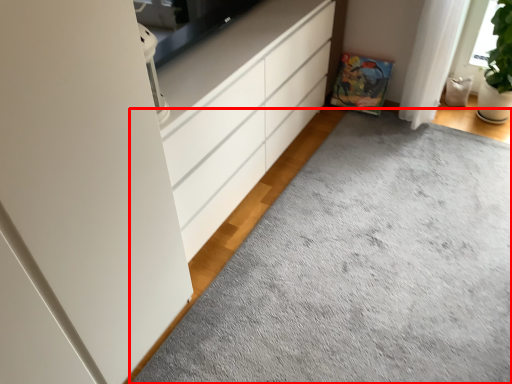
Question: From the image's perspective, what is the correct spatial relationship of plain (annotated by the red box) in relation to chest of drawers?

Choices:
 (A) above
 (B) below

Answer: (B)